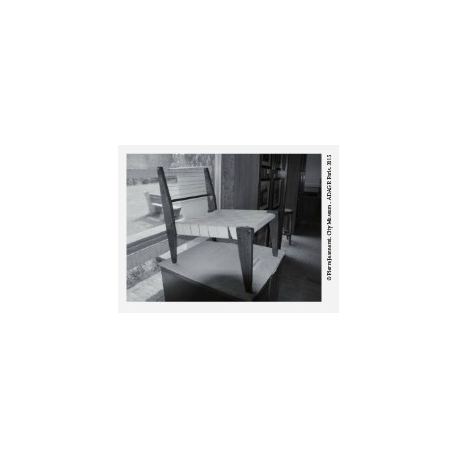
Locate an element on the screen. The width and height of the screenshot is (458, 458). wooden beam is located at coordinates (294, 195).